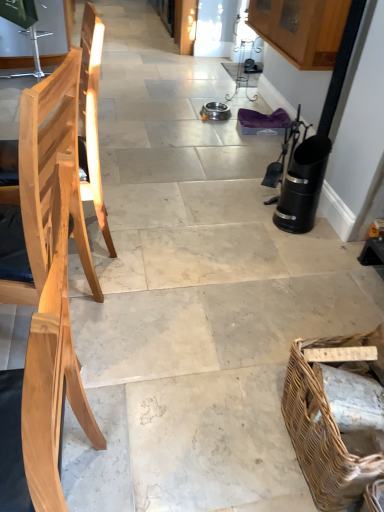
You are a GUI agent. You are given a task and a screenshot of the screen. Output one action in this format:
    pyautogui.click(x=<x>, y=<y>)
    Task: Click on the vacant space to the right of natural wood chair at left, marked as the first chair in a back-to-front arrangement
    The height and width of the screenshot is (512, 384).
    Given the screenshot: What is the action you would take?
    pyautogui.click(x=142, y=244)